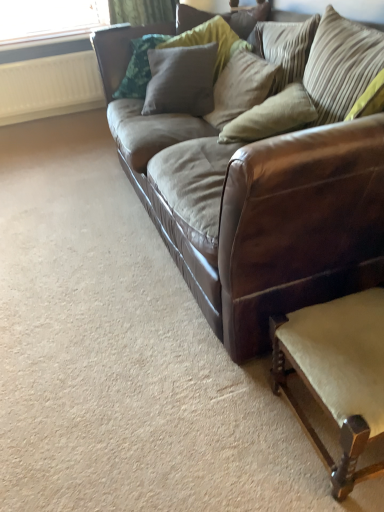
This screenshot has height=512, width=384. In order to click on vacant space situated above light beige fabric swivel chair at lower right (from a real-world perspective) in this screenshot , I will do `click(350, 338)`.